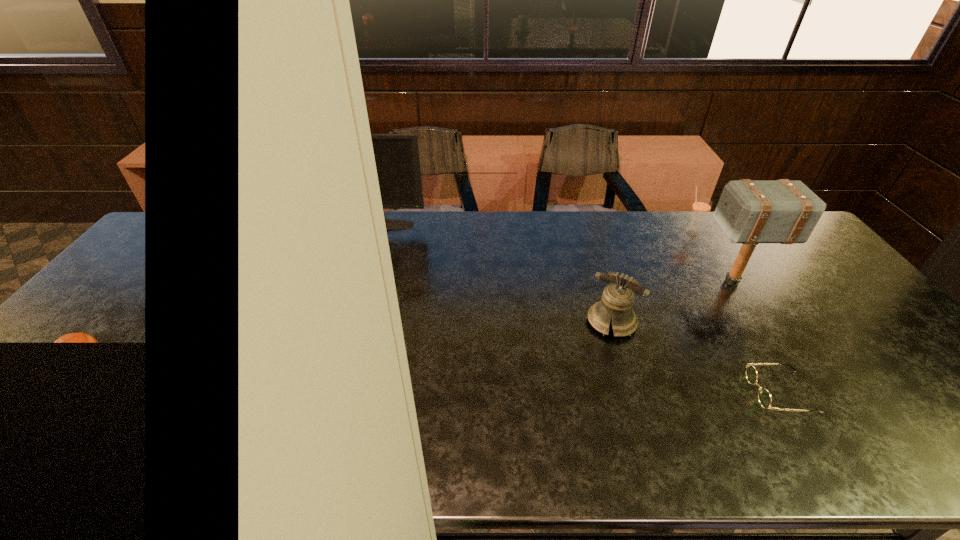
Where is `vacant space in between the straw and the nearest object`? Image resolution: width=960 pixels, height=540 pixels. vacant space in between the straw and the nearest object is located at coordinates (736, 313).

The width and height of the screenshot is (960, 540). What are the coordinates of `the second closest object to the monitor` in the screenshot? It's located at (749, 212).

Locate an element on the screen. object identified as the third closest to the nearest object is located at coordinates (701, 207).

Where is `vacant space that satisfies the following two spatial constraints: 1. on the front-facing side of the straw; 2. on the left side of the monitor`? vacant space that satisfies the following two spatial constraints: 1. on the front-facing side of the straw; 2. on the left side of the monitor is located at coordinates (361, 233).

At what (x,y) coordinates should I click in order to perform the action: click on free space that satisfies the following two spatial constraints: 1. on the front-facing side of the monitor; 2. on the left side of the fourth object from right to left. Please return your answer as a coordinate pair (x, y). Looking at the image, I should click on (330, 322).

Locate an element on the screen. The width and height of the screenshot is (960, 540). free location that satisfies the following two spatial constraints: 1. on the front-facing side of the monitor; 2. on the left side of the straw is located at coordinates (361, 233).